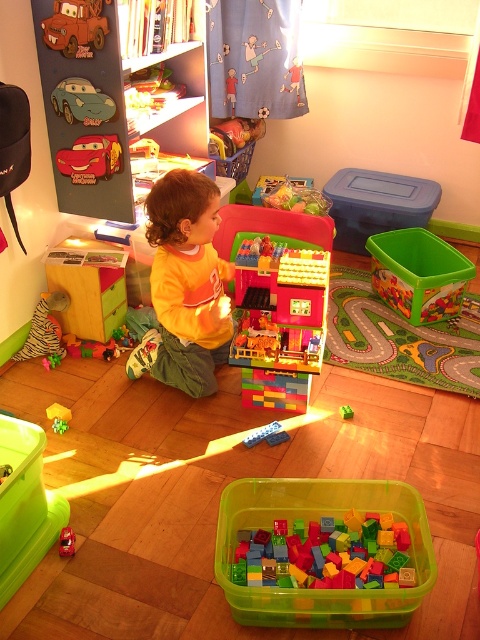
You are a parent trying to retrieve a toy for your child. You see the metallic red car at upper left and the matte yellow shirt at center. If you are standing at the entrance of the room, which object is closer to you?

The metallic red car at upper left is closer to you since it is only 34.78 inches away from the matte yellow shirt at center, but without knowing the exact distance from the entrance, we cannot determine which is closer. However, based on their positions, if the entrance is near the upper left area, the metallic red car would be closer. If the entrance is elsewhere, the distances might vary. The given information only specifies their separation, not their relation to the entrance.

You are a parent trying to place a new toy on the shelf in the playroom. You have two cars to choose from. The metallic red car at left and the metallic green car at upper left. Which car is taller and should be placed on the lower shelf to avoid blocking the view of the smaller one?

The metallic red car at left is taller than the metallic green car at upper left, so it should be placed on the lower shelf to avoid blocking the view of the smaller metallic green car at upper left.

You are a parent trying to organize the playroom. You have two cars, the metallic red car at left and the metallic green car at upper left. Which car takes up more space in the playroom?

The metallic red car at left is bigger than the metallic green car at upper left, so it takes up more space in the playroom.